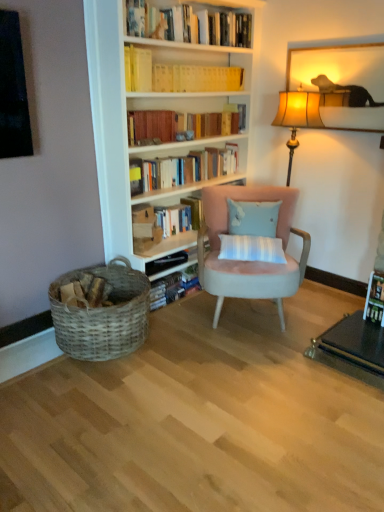
Where is `free location to the right of woven wood basket at lower left`? This screenshot has height=512, width=384. free location to the right of woven wood basket at lower left is located at coordinates (185, 345).